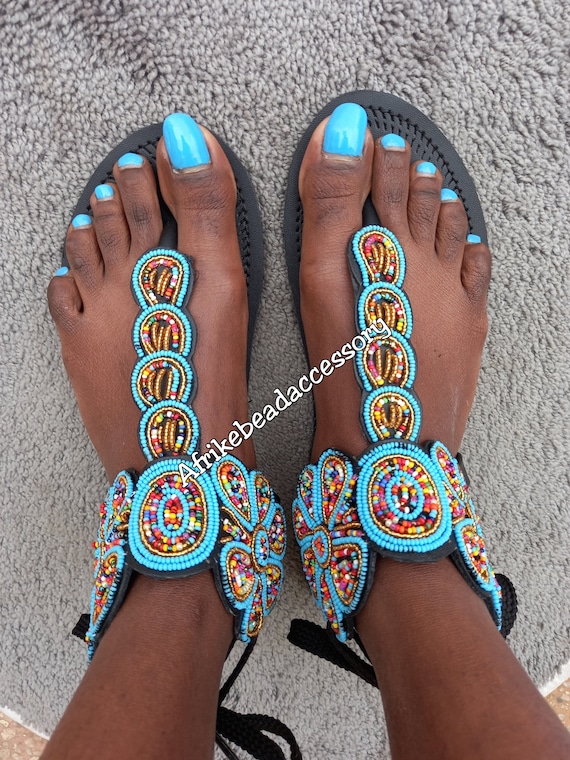
Identify the location of yellow colored bead. (410, 529), (419, 467), (199, 524), (174, 515).